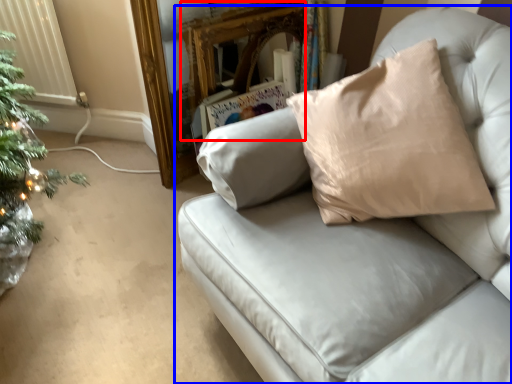
Question: Which point is closer to the camera, mirror (highlighted by a red box) or studio couch (highlighted by a blue box)?

Choices:
 (A) mirror
 (B) studio couch

Answer: (B)